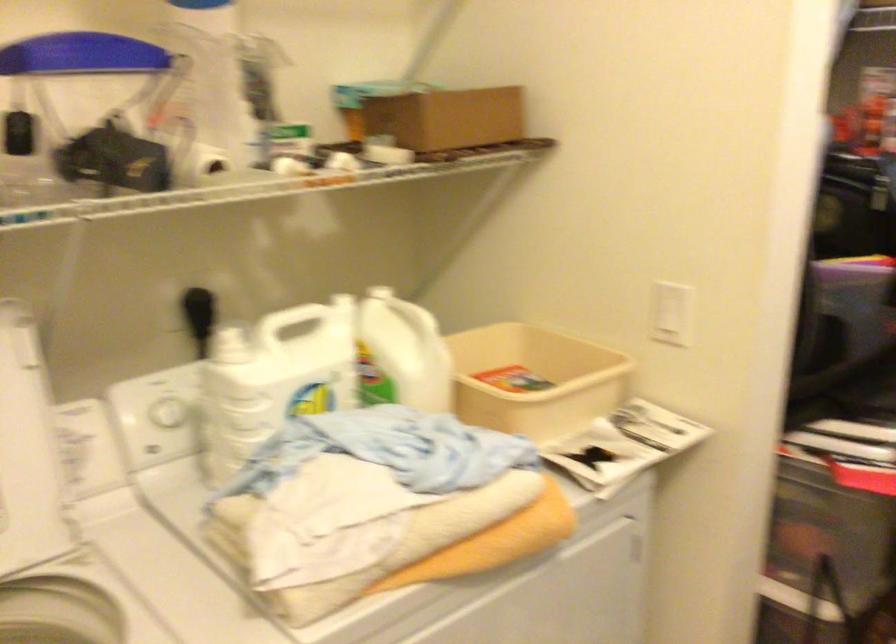
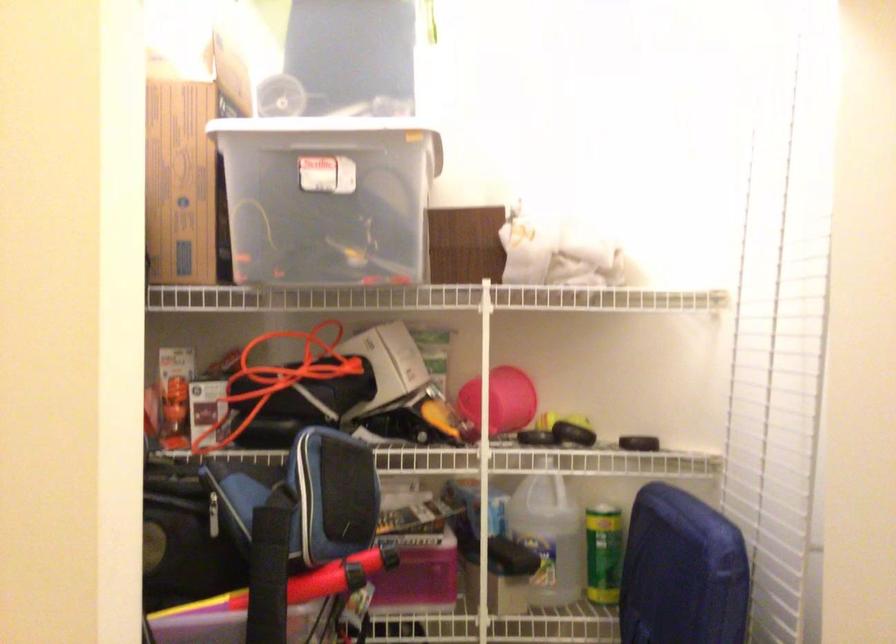
Question: Based on the continuous images, in which direction is the camera rotating? Reply with the corresponding letter.

Choices:
 (A) Left
 (B) Right
 (C) Up
 (D) Down

Answer: (B)